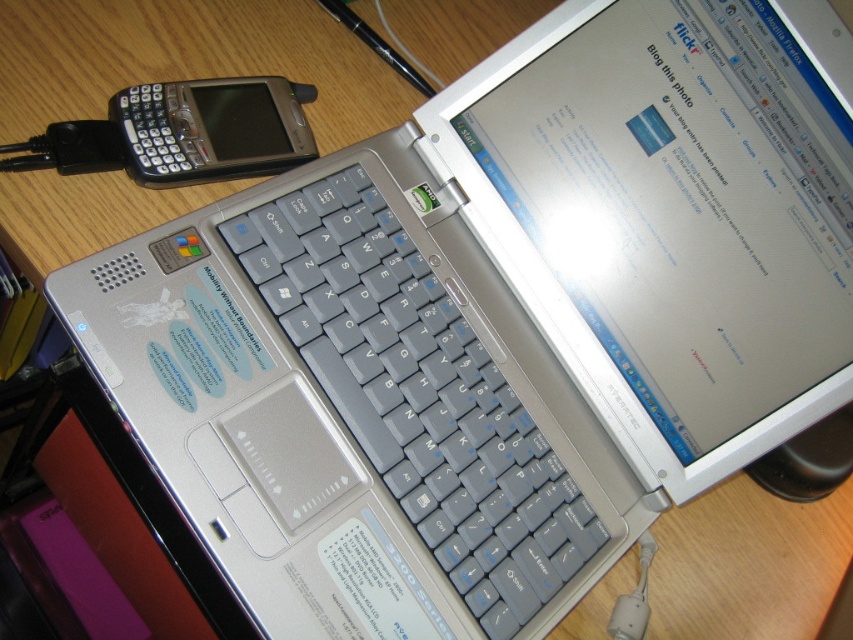
Question: Does gray plastic keyboard at center come in front of black plastic smartphone at upper left?

Choices:
 (A) no
 (B) yes

Answer: (B)

Question: Which of the following is the farthest from the observer?

Choices:
 (A) black plastic smartphone at upper left
 (B) gray plastic keyboard at center

Answer: (A)

Question: Does gray plastic keyboard at center have a greater width compared to black plastic smartphone at upper left?

Choices:
 (A) no
 (B) yes

Answer: (B)

Question: Observing the image, what is the correct spatial positioning of gray plastic keyboard at center in reference to black plastic smartphone at upper left?

Choices:
 (A) below
 (B) above

Answer: (A)

Question: Which object appears closest to the camera in this image?

Choices:
 (A) black plastic smartphone at upper left
 (B) gray plastic keyboard at center

Answer: (B)

Question: Which point appears closest to the camera in this image?

Choices:
 (A) (195, 147)
 (B) (361, 198)

Answer: (A)